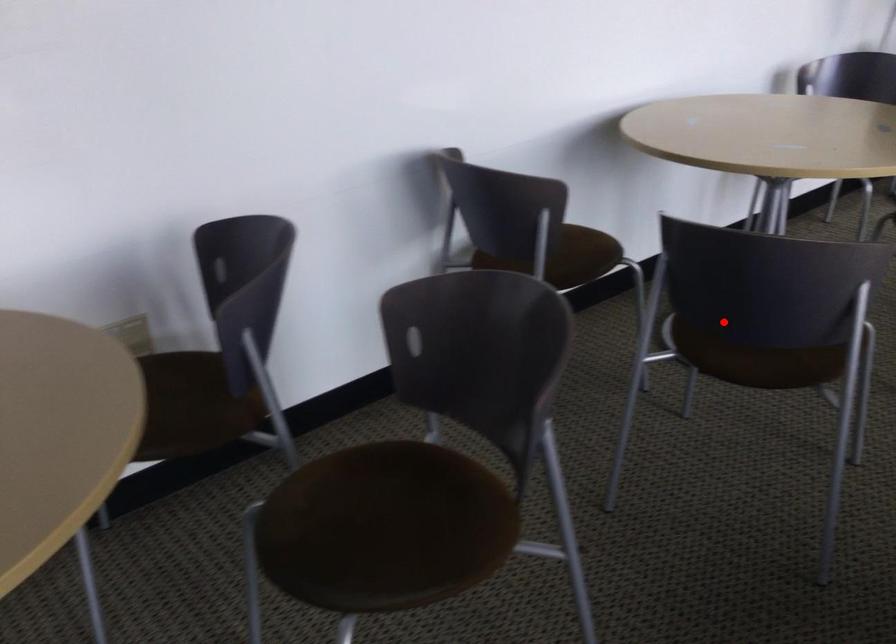
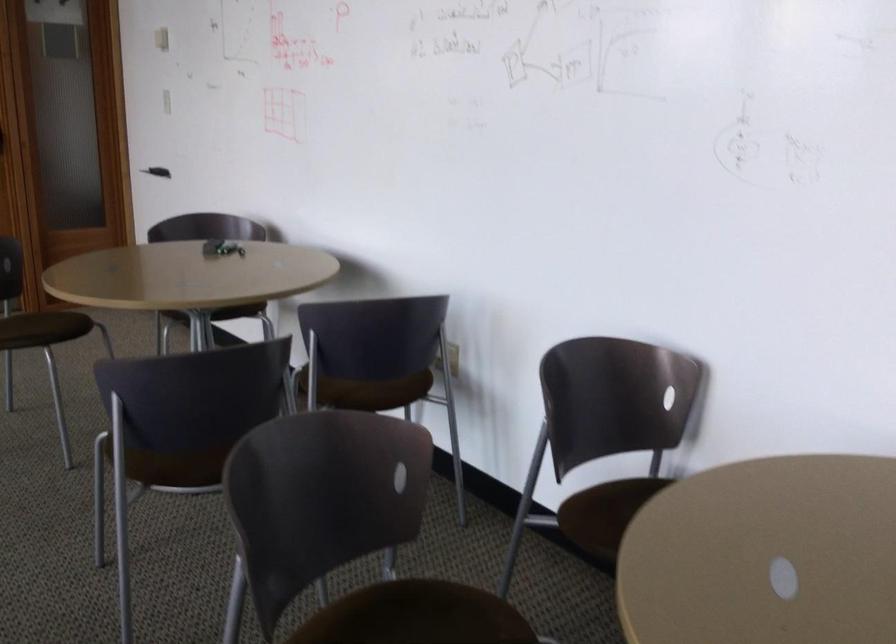
Question: A red point is marked in image1. In image2, is the corresponding 3D point closer to the camera or farther? Reply with the corresponding letter.

Choices:
 (A) The corresponding 3D point is closer.
 (B) The corresponding 3D point is farther.

Answer: (A)